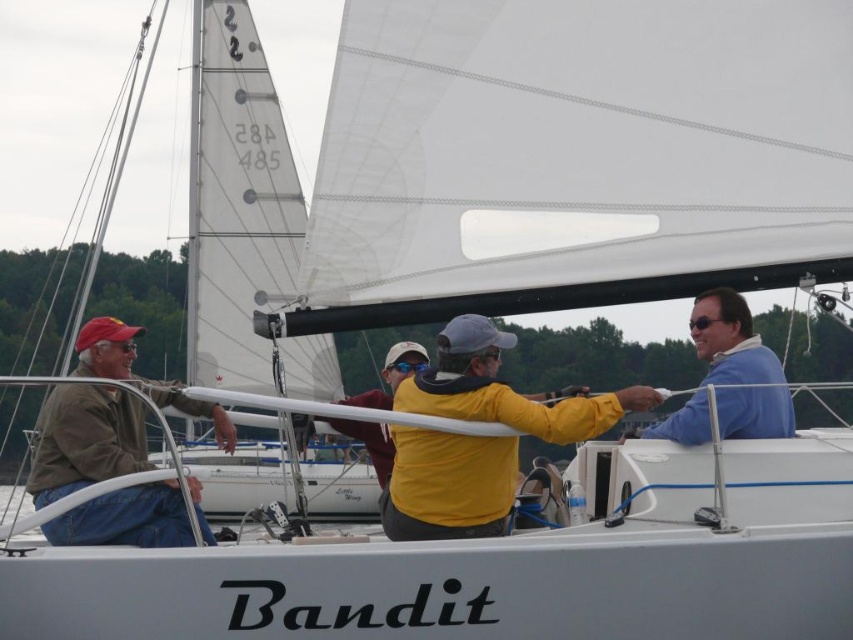
You are a photographer trying to capture both the brown leather jacket at left and the blue smooth shirt at upper right in a single frame. Since you want to emphasize the size difference between them, which object should you position closer to the camera to achieve this effect?

To emphasize the size difference between the brown leather jacket at left and the blue smooth shirt at upper right, you should position the brown leather jacket at left closer to the camera since it is wider than the blue smooth shirt at upper right. This will make it appear even larger in comparison.

You are standing on the deck of the sailboat named Bandit and looking at two points marked on the sail. The first point is at coordinates point (492, 515) and the second point is at point (717, 390). Which of these points is closer to you?

Point (492, 515) is closer to the viewer than point (717, 390).

Looking at this image, you are a passenger on the Bandit sailboat and notice two jackets on the deck. Which jacket is closer to the right side of the boat? The jackets are the yellow matte jacket at center and the brown leather jacket at left.

The yellow matte jacket at center is positioned on the right side of the brown leather jacket at left, so it is closer to the right side of the boat.